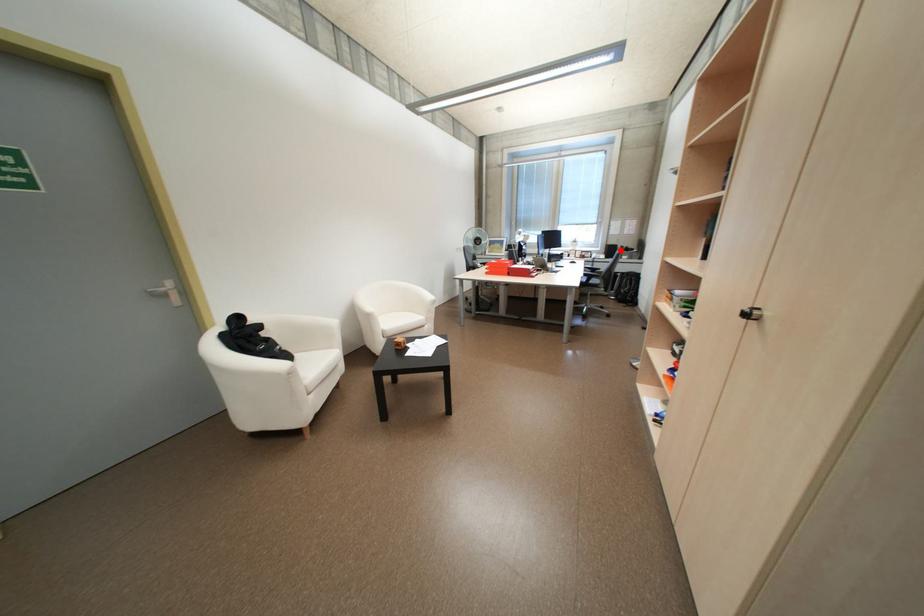
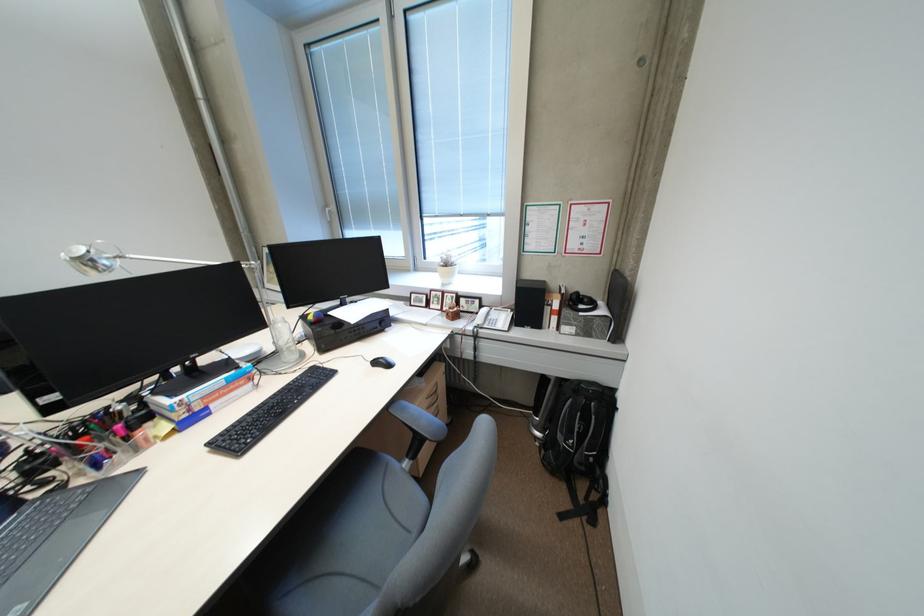
Locate, in the second image, the point that corresponds to the highlighted location in the first image.

(538, 302)